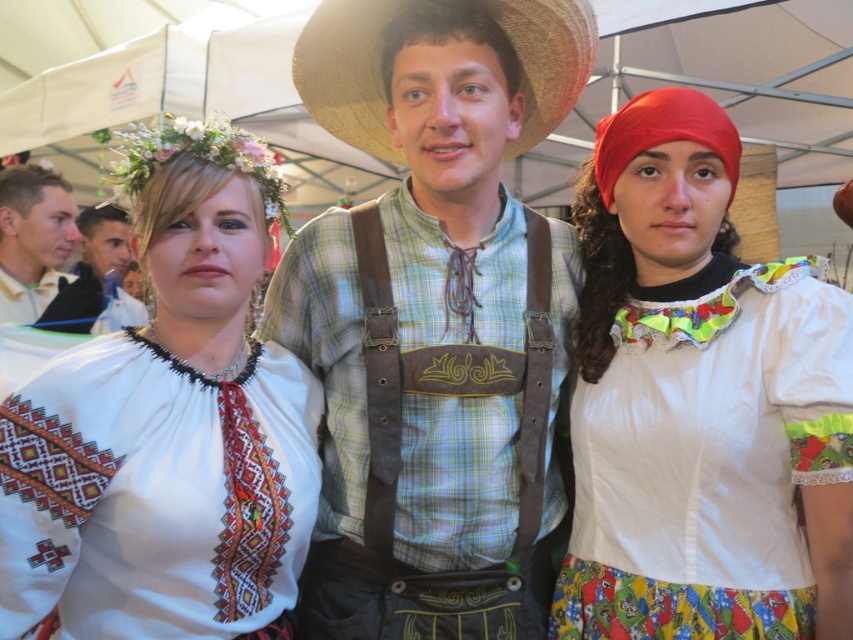
The image size is (853, 640). What do you see at coordinates (434, 316) in the screenshot?
I see `green plaid shirt at center` at bounding box center [434, 316].

Is green plaid shirt at center to the right of white embroidered blouse at center from the viewer's perspective?

Correct, you'll find green plaid shirt at center to the right of white embroidered blouse at center.

Between point (518, 72) and point (264, 266), which one is positioned in front?

Point (264, 266) is in front.

Where is `green plaid shirt at center`? Image resolution: width=853 pixels, height=640 pixels. green plaid shirt at center is located at coordinates (434, 316).

Which is in front, point (346, 465) or point (640, 340)?

Point (346, 465) is in front.

Does point (498, 28) come farther from viewer compared to point (769, 420)?

Yes, it is.

Is point (566, 234) farther from camera compared to point (686, 616)?

Yes, point (566, 234) is behind point (686, 616).

I want to click on green plaid shirt at center, so click(x=434, y=316).

Which of these two, white cotton blouse at center or white embroidered blouse at center, stands taller?

white cotton blouse at center is taller.

Who is lower down, white cotton blouse at center or white embroidered blouse at center?

white embroidered blouse at center is below.

This screenshot has height=640, width=853. What do you see at coordinates (700, 403) in the screenshot? I see `white cotton blouse at center` at bounding box center [700, 403].

Find the location of `white cotton blouse at center`. white cotton blouse at center is located at coordinates (700, 403).